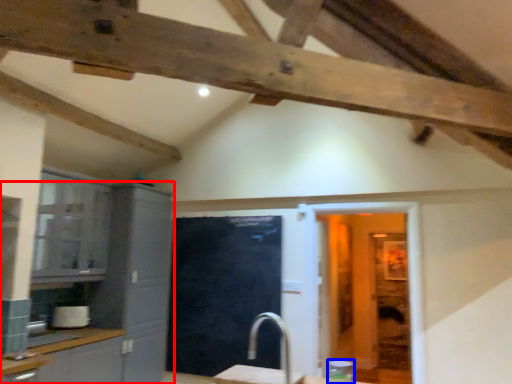
Question: Which object appears closest to the camera in this image, cabinetry (highlighted by a red box) or appliance (highlighted by a blue box)?

Choices:
 (A) cabinetry
 (B) appliance

Answer: (B)